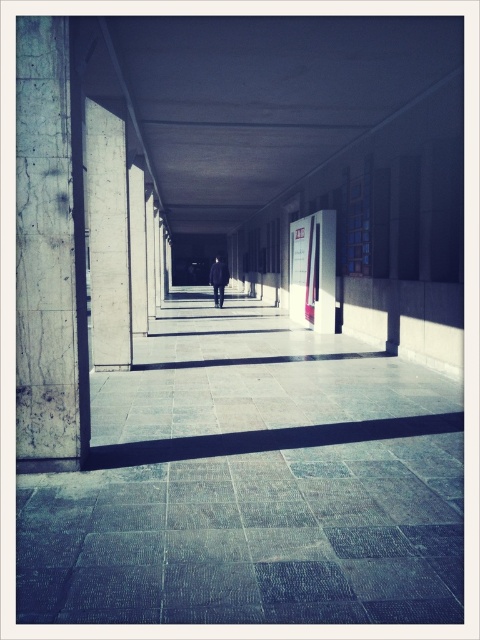
Question: Among these objects, which one is nearest to the camera?

Choices:
 (A) marble pillar at left
 (B) dark wool coat at center

Answer: (A)

Question: Which point appears farthest from the camera in this image?

Choices:
 (A) (219, 264)
 (B) (24, 179)

Answer: (A)

Question: Can you confirm if marble pillar at left is positioned to the left of dark wool coat at center?

Choices:
 (A) yes
 (B) no

Answer: (A)

Question: Which point is farther to the camera?

Choices:
 (A) (56, 42)
 (B) (227, 276)

Answer: (B)

Question: Does marble pillar at left appear on the right side of dark wool coat at center?

Choices:
 (A) no
 (B) yes

Answer: (A)

Question: Is marble pillar at left above dark wool coat at center?

Choices:
 (A) yes
 (B) no

Answer: (B)